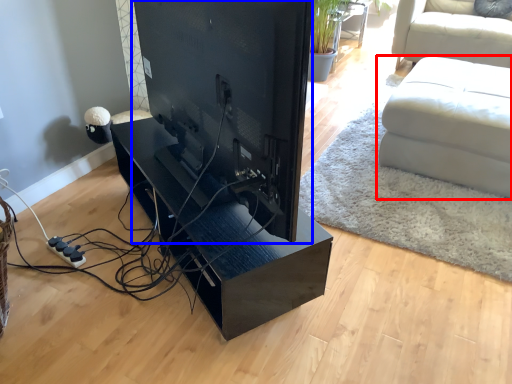
Question: Which of the following is the farthest to the observer, studio couch (highlighted by a red box) or desktop computer (highlighted by a blue box)?

Choices:
 (A) studio couch
 (B) desktop computer

Answer: (A)